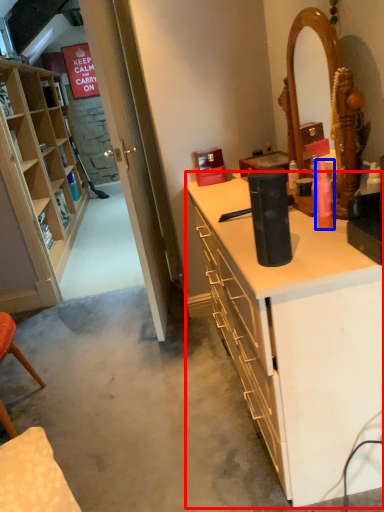
Question: Which object is further to the camera taking this photo, desk (highlighted by a red box) or toiletry (highlighted by a blue box)?

Choices:
 (A) desk
 (B) toiletry

Answer: (B)